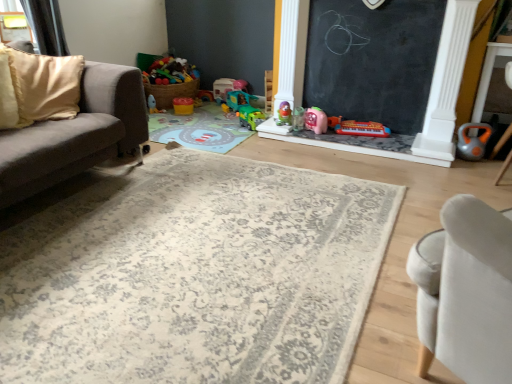
Question: Considering their positions, is orange rubber kettlebell at right, placed as the 1th toy when sorted from right to left, located in front of or behind transparent plastic window at upper left?

Choices:
 (A) behind
 (B) front

Answer: (B)

Question: Considering the positions of point (468, 150) and point (3, 28), is point (468, 150) closer or farther from the camera than point (3, 28)?

Choices:
 (A) closer
 (B) farther

Answer: (B)

Question: Estimate the real-world distances between objects in this image. Which object is farther from the translucent plastic cup at center, which appears as the 4th toy when viewed from the right?

Choices:
 (A) red plastic toy piano at center, the 2th toy from the right
 (B) beige fabric pillow at left
 (C) pink rubber duck at center, positioned as the third toy in right-to-left order
 (D) matte plastic toy at center, which appears as the sixth toy when viewed from the left
 (E) matte plastic toy at upper center, which ranks as the 1th toy in left-to-right order

Answer: (B)

Question: Which of these objects is positioned farthest from the transparent plastic window at upper left?

Choices:
 (A) beige fabric pillow at left
 (B) green plastic toy car at center, which is the 6th toy from right to left
 (C) pink rubber duck at center, arranged as the eighth toy when viewed from the left
 (D) red plastic toy piano at center, which appears as the ninth toy when viewed from the left
 (E) matte plastic toy at center, which appears as the sixth toy when viewed from the left

Answer: (D)